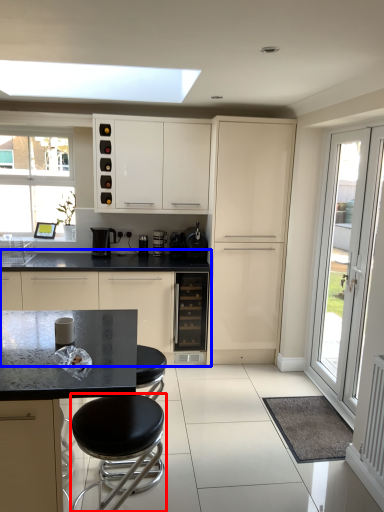
Question: Which object is closer to the camera taking this photo, stool (highlighted by a red box) or cabinetry (highlighted by a blue box)?

Choices:
 (A) stool
 (B) cabinetry

Answer: (A)